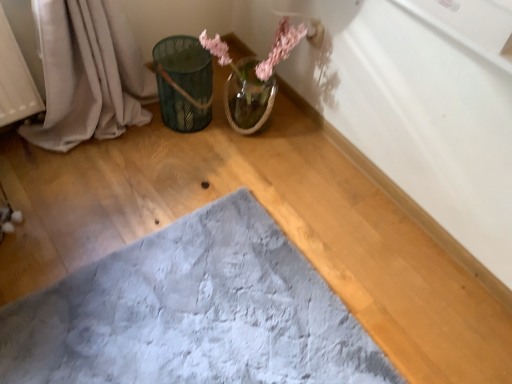
Identify the location of vacant area situated below translucent glass vase at upper center (from a real-world perspective). Image resolution: width=512 pixels, height=384 pixels. (248, 131).